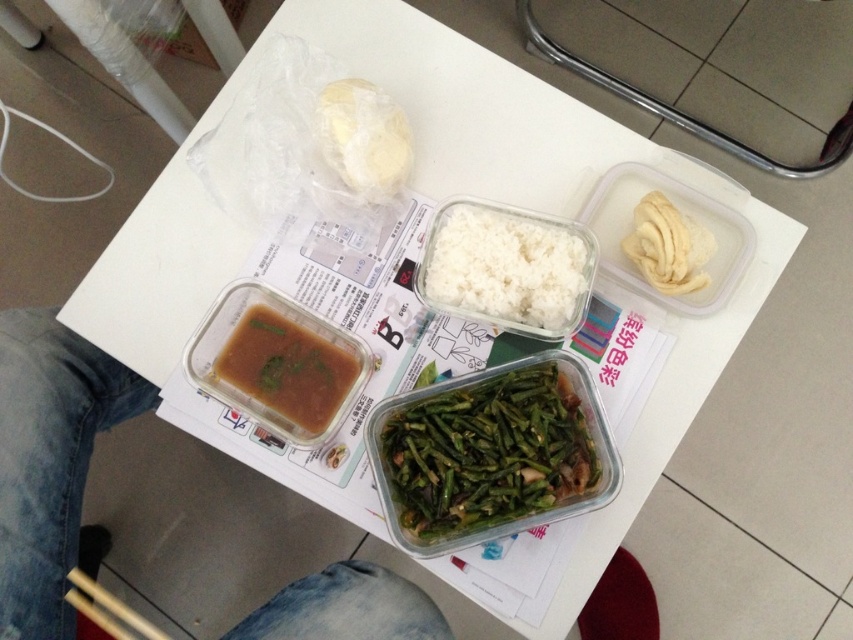
Question: Can you confirm if green glossy string beans at center is smaller than white matte rice at center?

Choices:
 (A) yes
 (B) no

Answer: (B)

Question: Which of the following is the closest to the observer?

Choices:
 (A) (664, 198)
 (B) (224, 355)
 (C) (100, 625)

Answer: (A)

Question: Which point appears closest to the camera in this image?

Choices:
 (A) (547, 428)
 (B) (111, 602)

Answer: (A)

Question: Does green glossy string beans at center lie in front of white crinkled chips at upper right?

Choices:
 (A) no
 (B) yes

Answer: (B)

Question: Can you confirm if white matte doughnut at upper center is positioned below wooden chopsticks at lower left?

Choices:
 (A) yes
 (B) no

Answer: (B)

Question: Estimate the real-world distances between objects in this image. Which object is farther from the green glossy string beans at center?

Choices:
 (A) wooden chopsticks at lower left
 (B) denim pants at lower left
 (C) white matte doughnut at upper center
 (D) white matte rice at center

Answer: (A)